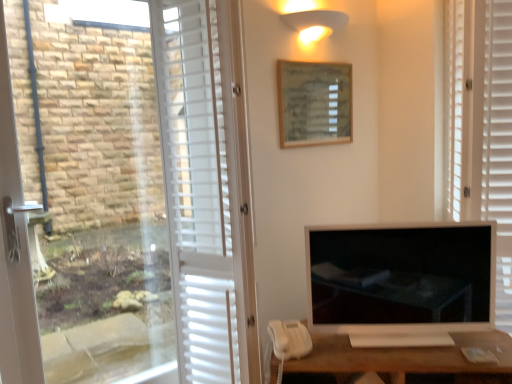
Question: Does white matte desk at lower right appear on the right side of wooden frame at upper center?

Choices:
 (A) yes
 (B) no

Answer: (A)

Question: Is white matte desk at lower right positioned in front of wooden frame at upper center?

Choices:
 (A) no
 (B) yes

Answer: (B)

Question: Does white matte desk at lower right have a lesser width compared to wooden frame at upper center?

Choices:
 (A) yes
 (B) no

Answer: (B)

Question: Is white matte desk at lower right far away from wooden frame at upper center?

Choices:
 (A) yes
 (B) no

Answer: (A)

Question: Considering the relative sizes of white matte desk at lower right and wooden frame at upper center in the image provided, is white matte desk at lower right bigger than wooden frame at upper center?

Choices:
 (A) yes
 (B) no

Answer: (A)

Question: From the image's perspective, is white matte desk at lower right over wooden frame at upper center?

Choices:
 (A) no
 (B) yes

Answer: (A)

Question: Can you confirm if white matte corded phone at lower center is wider than matte black monitor at center?

Choices:
 (A) no
 (B) yes

Answer: (B)

Question: Is the surface of white matte corded phone at lower center in direct contact with matte black monitor at center?

Choices:
 (A) yes
 (B) no

Answer: (B)

Question: Would you say matte black monitor at center is part of white matte corded phone at lower center's contents?

Choices:
 (A) yes
 (B) no

Answer: (B)

Question: Is white matte corded phone at lower center in front of matte black monitor at center?

Choices:
 (A) no
 (B) yes

Answer: (A)

Question: From the image's perspective, is white matte corded phone at lower center under matte black monitor at center?

Choices:
 (A) yes
 (B) no

Answer: (A)

Question: From a real-world perspective, is white matte corded phone at lower center positioned over matte black monitor at center based on gravity?

Choices:
 (A) no
 (B) yes

Answer: (A)

Question: Can you confirm if white matte blind at right is bigger than white matte corded phone at lower center?

Choices:
 (A) no
 (B) yes

Answer: (B)